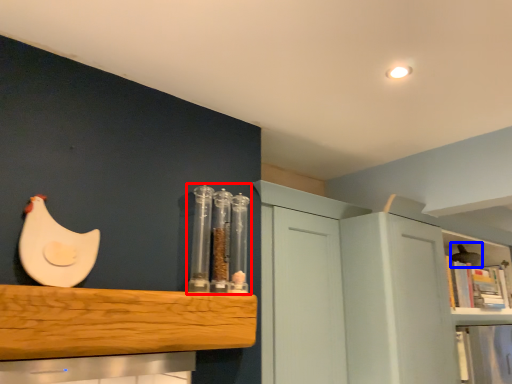
Question: Which point is closer to the camera, glass jar (highlighted by a red box) or chicken (highlighted by a blue box)?

Choices:
 (A) glass jar
 (B) chicken

Answer: (A)